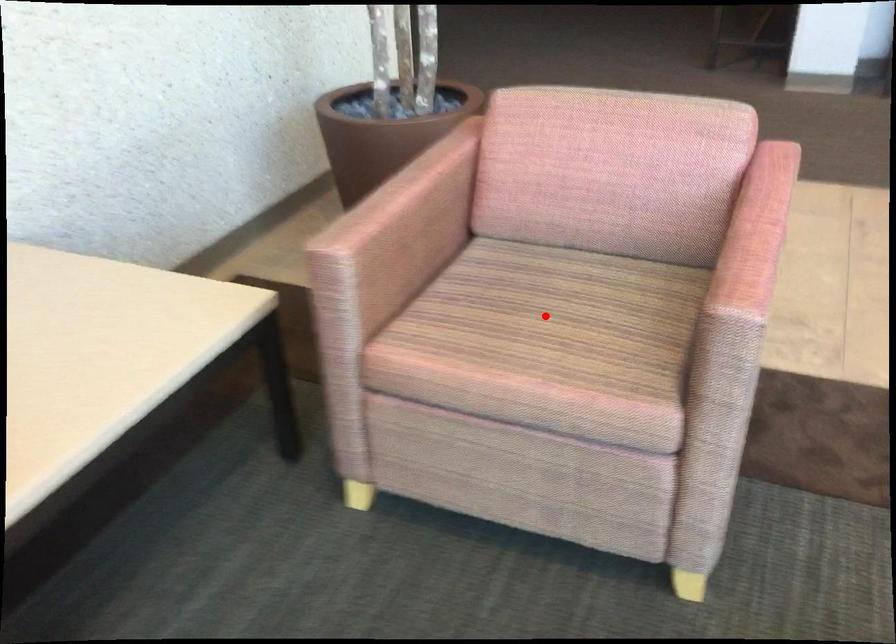
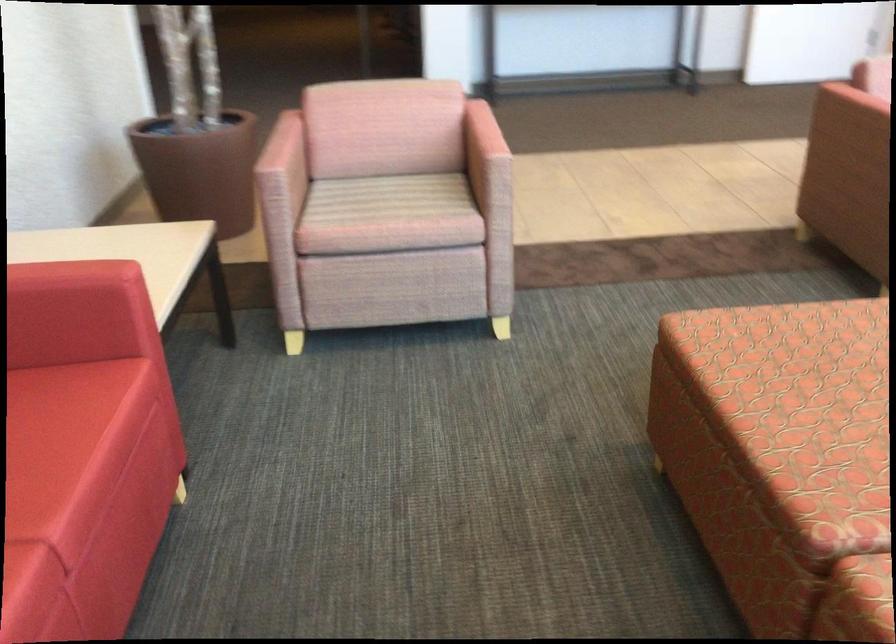
Find the pixel in the second image that matches the highlighted location in the first image.

(389, 198)